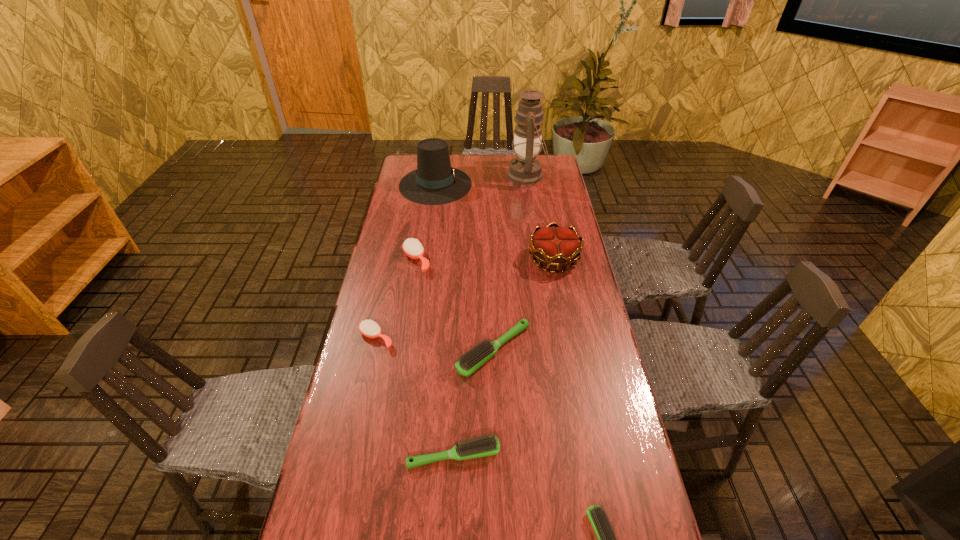
Where is `hat that is positioned at the far edge`? The image size is (960, 540). hat that is positioned at the far edge is located at coordinates [x=434, y=182].

Where is `hat present at the left edge`? hat present at the left edge is located at coordinates (434, 182).

Where is `oil lamp present at the right edge`? oil lamp present at the right edge is located at coordinates (525, 169).

You are a GUI agent. You are given a task and a screenshot of the screen. Output one action in this format:
    pyautogui.click(x=<x>, y=<y>)
    Task: Click on the crown that is at the right edge
    
    Given the screenshot: What is the action you would take?
    pyautogui.click(x=556, y=246)

This screenshot has height=540, width=960. Find the location of `object present at the far left corner`. object present at the far left corner is located at coordinates click(434, 182).

Image resolution: width=960 pixels, height=540 pixels. Identify the location of object located at the far right corner. (525, 169).

The image size is (960, 540). I want to click on free space at the far edge, so click(x=493, y=167).

At what (x,y) coordinates should I click in order to perform the action: click on vacant space at the left edge of the desktop. Please return your answer as a coordinate pair (x, y). Image resolution: width=960 pixels, height=540 pixels. Looking at the image, I should click on (384, 352).

Where is `free region at the right edge of the desktop`? This screenshot has width=960, height=540. free region at the right edge of the desktop is located at coordinates (552, 271).

You are a GUI agent. You are given a task and a screenshot of the screen. Output one action in this format:
    pyautogui.click(x=<x>, y=<y>)
    Task: Click on the vacant area that lies between the gold crown and the second nearest light hairbrush
    
    Given the screenshot: What is the action you would take?
    tap(504, 357)